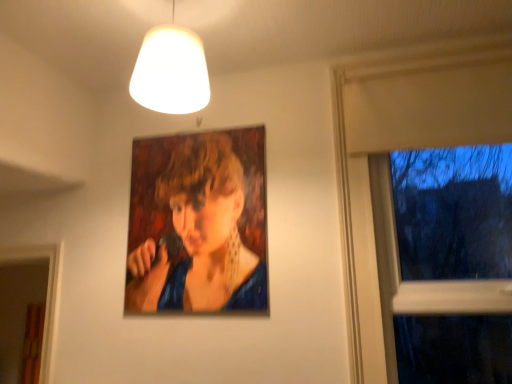
Locate an element on the screen. This screenshot has height=384, width=512. white matte lampshade at upper center is located at coordinates (170, 71).

From the image's perspective, would you say transparent glass window at right is positioned over white matte lampshade at upper center?

No, from the image's perspective, transparent glass window at right is not above white matte lampshade at upper center.

Considering the sizes of objects transparent glass window at right and white matte lampshade at upper center in the image provided, who is shorter, transparent glass window at right or white matte lampshade at upper center?

white matte lampshade at upper center.

From a real-world perspective, who is located higher, transparent glass window at right or white matte lampshade at upper center?

white matte lampshade at upper center, from a real-world perspective.

From a real-world perspective, is oil painting portrait at center on white matte lampshade at upper center?

No.

Considering the relative positions of oil painting portrait at center and white matte lampshade at upper center in the image provided, is oil painting portrait at center to the right of white matte lampshade at upper center from the viewer's perspective?

Yes, oil painting portrait at center is to the right of white matte lampshade at upper center.

Can you confirm if white matte lampshade at upper center is smaller than transparent glass window at right?

Yes, white matte lampshade at upper center is smaller than transparent glass window at right.

Is white matte lampshade at upper center next to transparent glass window at right?

white matte lampshade at upper center and transparent glass window at right are not in contact.

From the image's perspective, is white matte lampshade at upper center positioned above or below transparent glass window at right?

white matte lampshade at upper center is situated higher than transparent glass window at right in the image.

From the picture: Considering the positions of objects white matte lampshade at upper center and transparent glass window at right in the image provided, who is more to the left, white matte lampshade at upper center or transparent glass window at right?

white matte lampshade at upper center.

Which of these two, oil painting portrait at center or transparent glass window at right, is thinner?

oil painting portrait at center is thinner.

Considering the relative sizes of oil painting portrait at center and transparent glass window at right in the image provided, is oil painting portrait at center shorter than transparent glass window at right?

Indeed, oil painting portrait at center has a lesser height compared to transparent glass window at right.

Who is smaller, oil painting portrait at center or transparent glass window at right?

Smaller between the two is oil painting portrait at center.

Is the depth of oil painting portrait at center less than that of transparent glass window at right?

No, it is behind transparent glass window at right.

Is transparent glass window at right to the right of oil painting portrait at center from the viewer's perspective?

Yes.

Which object is more forward, transparent glass window at right or oil painting portrait at center?

transparent glass window at right is in front.

Is transparent glass window at right far from oil painting portrait at center?

They are positioned close to each other.

Image resolution: width=512 pixels, height=384 pixels. Identify the location of window in front of the oil painting portrait at center. (445, 262).

Is white matte lampshade at upper center far from oil painting portrait at center?

They are positioned close to each other.

Consider the image. Does white matte lampshade at upper center turn towards oil painting portrait at center?

No, white matte lampshade at upper center is not facing towards oil painting portrait at center.

Considering the sizes of objects white matte lampshade at upper center and oil painting portrait at center in the image provided, who is taller, white matte lampshade at upper center or oil painting portrait at center?

Standing taller between the two is oil painting portrait at center.

Where is `window that is on the right side of white matte lampshade at upper center`? window that is on the right side of white matte lampshade at upper center is located at coordinates (445, 262).

You are a GUI agent. You are given a task and a screenshot of the screen. Output one action in this format:
    pyautogui.click(x=<x>, y=<y>)
    Task: Click on the person that is behind the white matte lampshade at upper center
    The height and width of the screenshot is (384, 512).
    Given the screenshot: What is the action you would take?
    pyautogui.click(x=198, y=224)

From the image, which object appears to be nearer to transparent glass window at right, white matte lampshade at upper center or oil painting portrait at center?

The object closer to transparent glass window at right is oil painting portrait at center.

Looking at the image, which one is located further to transparent glass window at right, oil painting portrait at center or white matte lampshade at upper center?

Based on the image, white matte lampshade at upper center appears to be further to transparent glass window at right.

Estimate the real-world distances between objects in this image. Which object is further from white matte lampshade at upper center, transparent glass window at right or oil painting portrait at center?

transparent glass window at right is further to white matte lampshade at upper center.

When comparing their distances from white matte lampshade at upper center, does oil painting portrait at center or transparent glass window at right seem closer?

oil painting portrait at center is closer to white matte lampshade at upper center.

Based on their spatial positions, is transparent glass window at right or white matte lampshade at upper center further from oil painting portrait at center?

Among the two, transparent glass window at right is located further to oil painting portrait at center.

Estimate the real-world distances between objects in this image. Which object is closer to oil painting portrait at center, white matte lampshade at upper center or transparent glass window at right?

The object closer to oil painting portrait at center is white matte lampshade at upper center.

At what (x,y) coordinates should I click in order to perform the action: click on person between white matte lampshade at upper center and transparent glass window at right. Please return your answer as a coordinate pair (x, y). Image resolution: width=512 pixels, height=384 pixels. Looking at the image, I should click on (198, 224).